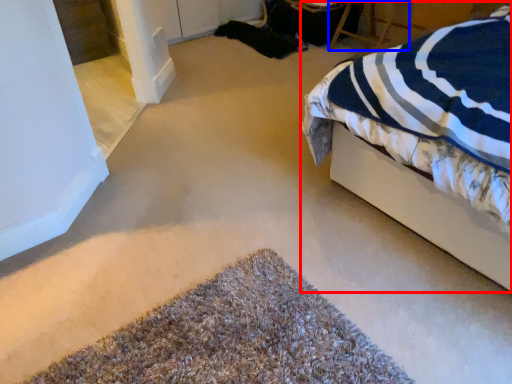
Question: Which object appears closest to the camera in this image, bed (highlighted by a red box) or chair (highlighted by a blue box)?

Choices:
 (A) bed
 (B) chair

Answer: (A)